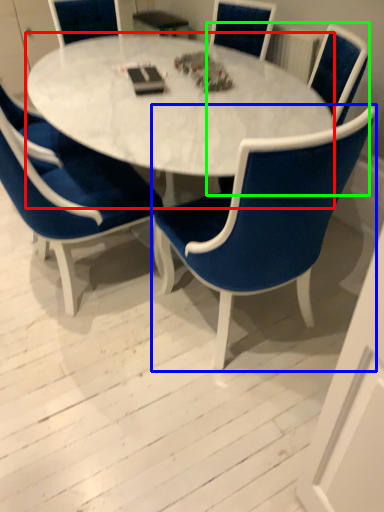
Question: Which object is the closest to the coffee table (highlighted by a red box)? Choose among these: chair (highlighted by a blue box) or chair (highlighted by a green box).

Choices:
 (A) chair
 (B) chair

Answer: (A)